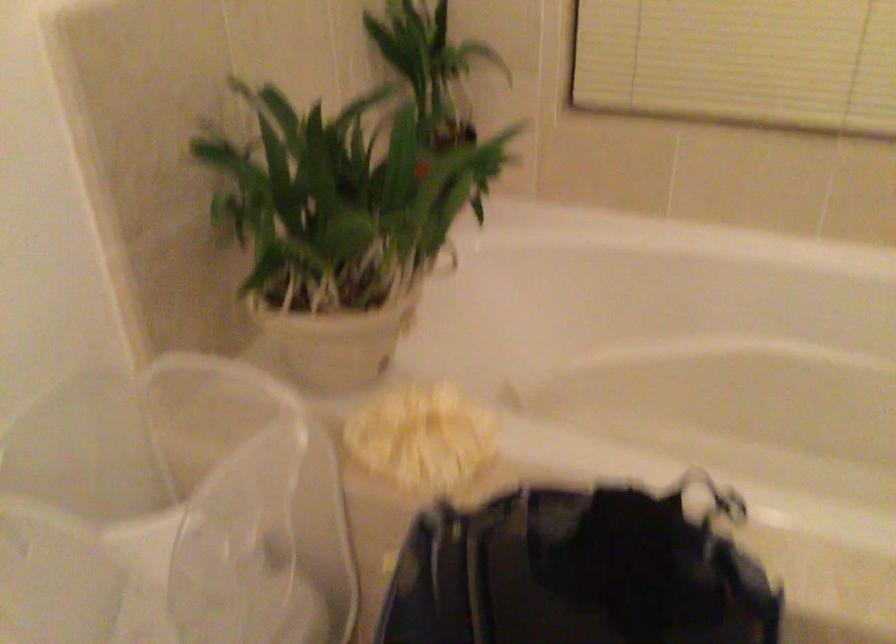
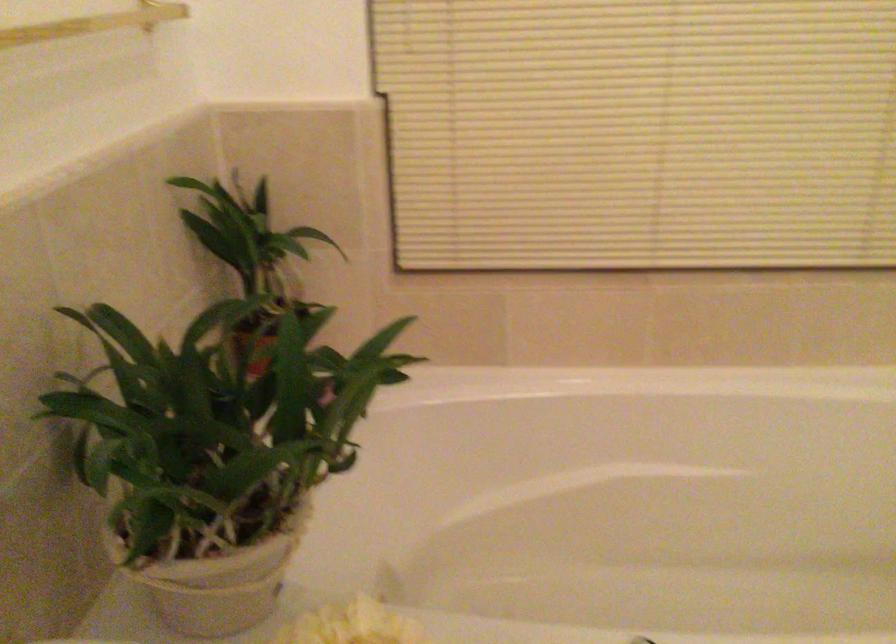
Where in the second image is the point corresponding to [324,343] from the first image?

(218, 579)